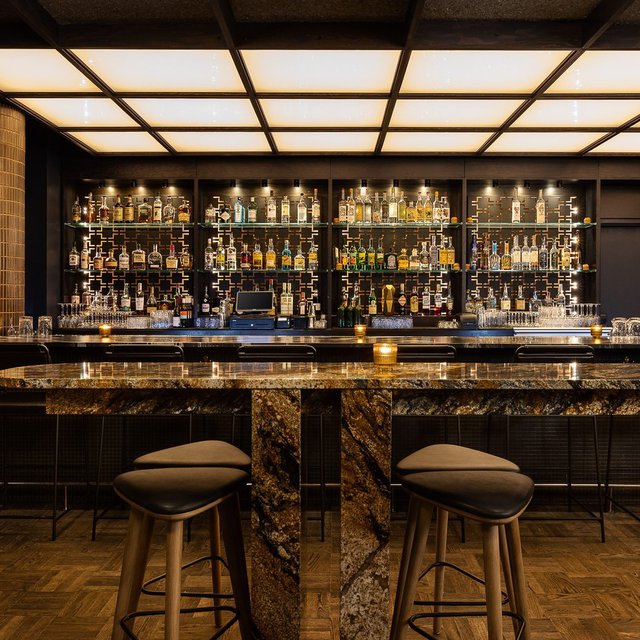
The height and width of the screenshot is (640, 640). I want to click on triangular shaped barstool padding, so click(479, 496), click(445, 451), click(184, 491), click(214, 451).